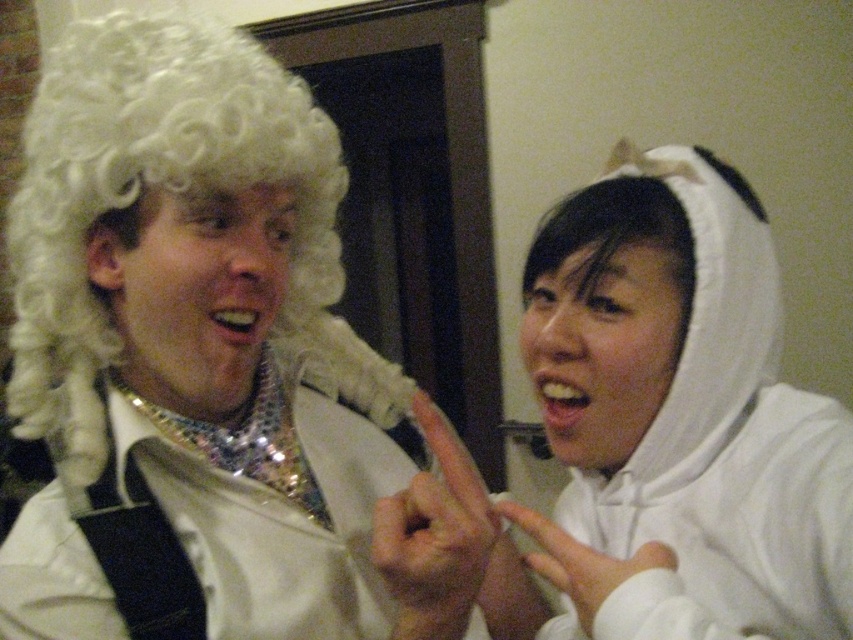
Question: Which of the following is the closest to the observer?

Choices:
 (A) white curly wig at left
 (B) shiny sequined robe at left

Answer: (B)

Question: Can you confirm if white plush hoodie at upper right is positioned to the left of shiny sequined robe at left?

Choices:
 (A) no
 (B) yes

Answer: (A)

Question: Estimate the real-world distances between objects in this image. Which object is closer to the white plush hoodie at upper right?

Choices:
 (A) shiny sequined robe at left
 (B) white curly wig at left

Answer: (A)

Question: Among these objects, which one is nearest to the camera?

Choices:
 (A) white curly wig at left
 (B) white plush hoodie at upper right
 (C) shiny sequined robe at left

Answer: (B)

Question: Does white plush hoodie at upper right appear under white curly wig at left?

Choices:
 (A) no
 (B) yes

Answer: (B)

Question: Does white curly wig at left have a greater width compared to shiny sequined robe at left?

Choices:
 (A) no
 (B) yes

Answer: (A)